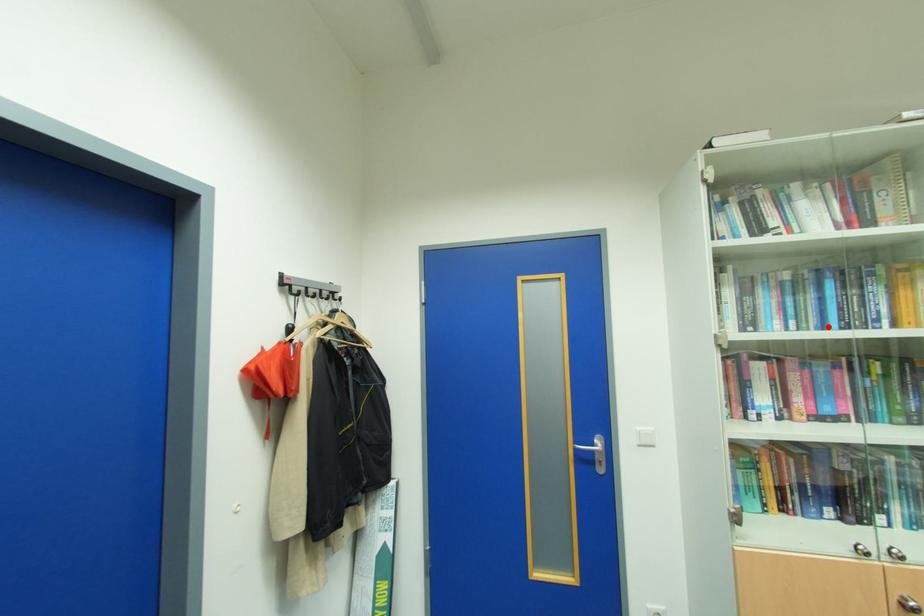
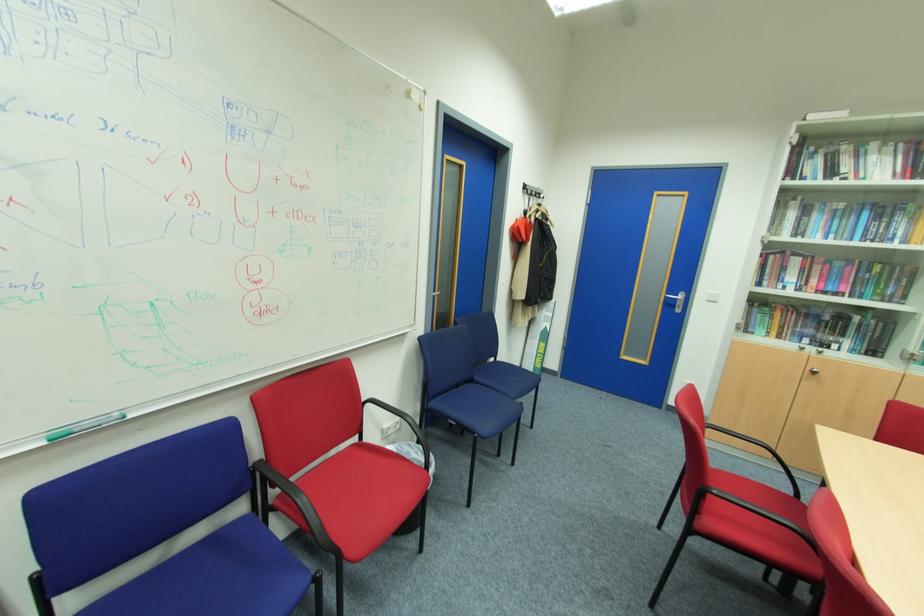
In the second image, find the point that corresponds to the highlighted location in the first image.

(854, 240)